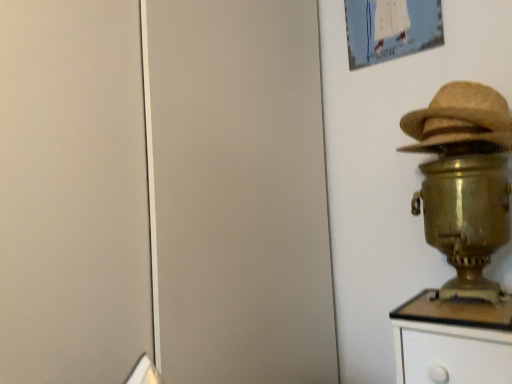
Question: Is gold metallic samovar at right a part of matte paper picture frame at upper right?

Choices:
 (A) no
 (B) yes

Answer: (A)

Question: Is matte paper picture frame at upper right touching gold metallic samovar at right?

Choices:
 (A) no
 (B) yes

Answer: (A)

Question: Are matte paper picture frame at upper right and gold metallic samovar at right located far from each other?

Choices:
 (A) yes
 (B) no

Answer: (B)

Question: Does matte paper picture frame at upper right have a greater height compared to gold metallic samovar at right?

Choices:
 (A) yes
 (B) no

Answer: (B)

Question: From the image's perspective, is matte paper picture frame at upper right over gold metallic samovar at right?

Choices:
 (A) yes
 (B) no

Answer: (A)

Question: Does matte paper picture frame at upper right have a lesser width compared to gold metallic samovar at right?

Choices:
 (A) no
 (B) yes

Answer: (B)

Question: Considering the relative sizes of braided straw hat at right and matte paper picture frame at upper right in the image provided, is braided straw hat at right wider than matte paper picture frame at upper right?

Choices:
 (A) no
 (B) yes

Answer: (B)

Question: From a real-world perspective, is braided straw hat at right under matte paper picture frame at upper right?

Choices:
 (A) yes
 (B) no

Answer: (A)

Question: Could matte paper picture frame at upper right be considered to be inside braided straw hat at right?

Choices:
 (A) no
 (B) yes

Answer: (A)

Question: From the image's perspective, is braided straw hat at right above matte paper picture frame at upper right?

Choices:
 (A) no
 (B) yes

Answer: (A)

Question: Considering the relative sizes of braided straw hat at right and matte paper picture frame at upper right in the image provided, is braided straw hat at right shorter than matte paper picture frame at upper right?

Choices:
 (A) no
 (B) yes

Answer: (B)

Question: Is braided straw hat at right in contact with matte paper picture frame at upper right?

Choices:
 (A) no
 (B) yes

Answer: (A)

Question: From the image's perspective, is gold metallic samovar at right beneath matte paper picture frame at upper right?

Choices:
 (A) yes
 (B) no

Answer: (A)